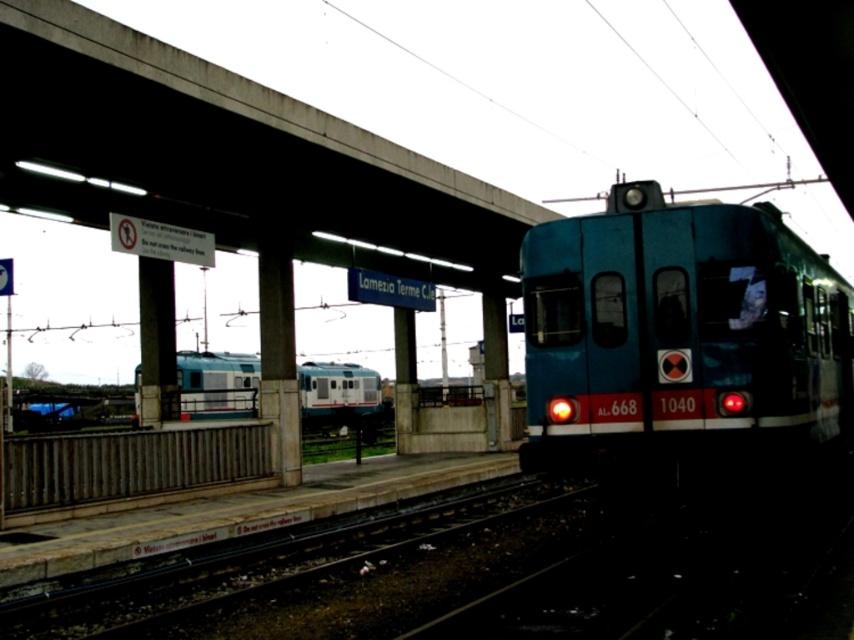
Question: Observing the image, what is the correct spatial positioning of concrete at upper center in reference to blue glossy train at center?

Choices:
 (A) left
 (B) right

Answer: (B)

Question: Which object is the farthest from the teal glossy train at right?

Choices:
 (A) concrete at upper center
 (B) blue glossy train at center

Answer: (B)

Question: In this image, where is teal glossy train at right located relative to blue glossy train at center?

Choices:
 (A) right
 (B) left

Answer: (A)

Question: Which object is the closest to the concrete at upper center?

Choices:
 (A) blue glossy train at center
 (B) teal glossy train at right

Answer: (B)

Question: Does concrete at upper center have a larger size compared to teal glossy train at right?

Choices:
 (A) yes
 (B) no

Answer: (B)

Question: Which of the following is the closest to the observer?

Choices:
 (A) teal glossy train at right
 (B) blue glossy train at center
 (C) concrete at upper center

Answer: (A)